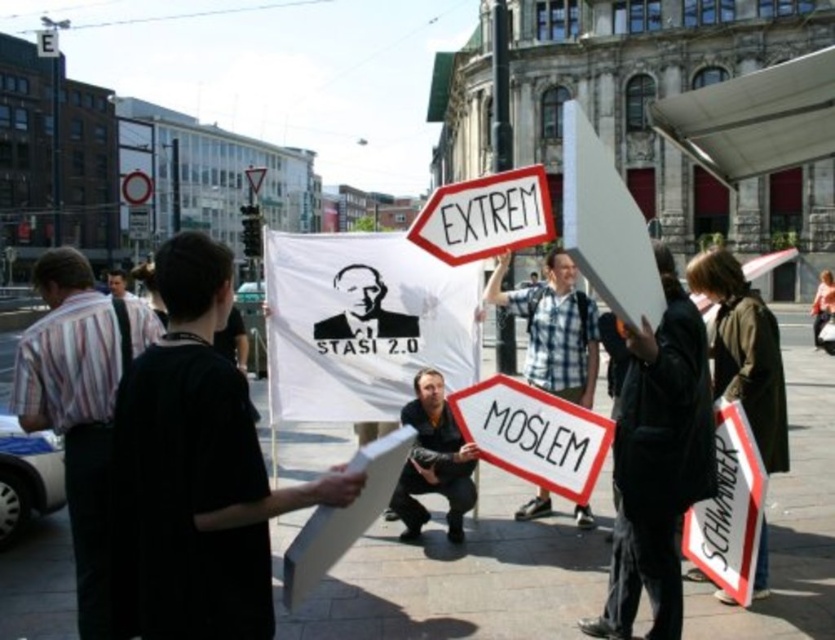
Question: Which object appears closest to the camera in this image?

Choices:
 (A) plaid fabric shirt at center
 (B) white plastic sign at center
 (C) striped fabric shirt at left

Answer: (C)

Question: Which object appears closest to the camera in this image?

Choices:
 (A) plaid fabric shirt at center
 (B) striped fabric shirt at left
 (C) dark brown leather jacket at center

Answer: (B)

Question: Where is white paper sign at center located in relation to plaid fabric shirt at center in the image?

Choices:
 (A) right
 (B) left

Answer: (B)

Question: Can you confirm if white plastic sign at center is positioned to the right of dark brown leather jacket at center?

Choices:
 (A) no
 (B) yes

Answer: (B)

Question: Among these objects, which one is nearest to the camera?

Choices:
 (A) striped fabric shirt at left
 (B) white plastic sign at center

Answer: (A)

Question: Does white plastic sign at center have a lesser width compared to dark blue shirt at center?

Choices:
 (A) no
 (B) yes

Answer: (A)